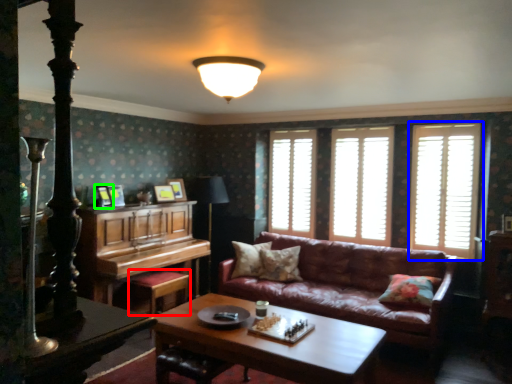
Question: Which is farther away from footrest (highlighted by a red box)? window (highlighted by a blue box) or picture frame (highlighted by a green box)?

Choices:
 (A) window
 (B) picture frame

Answer: (A)